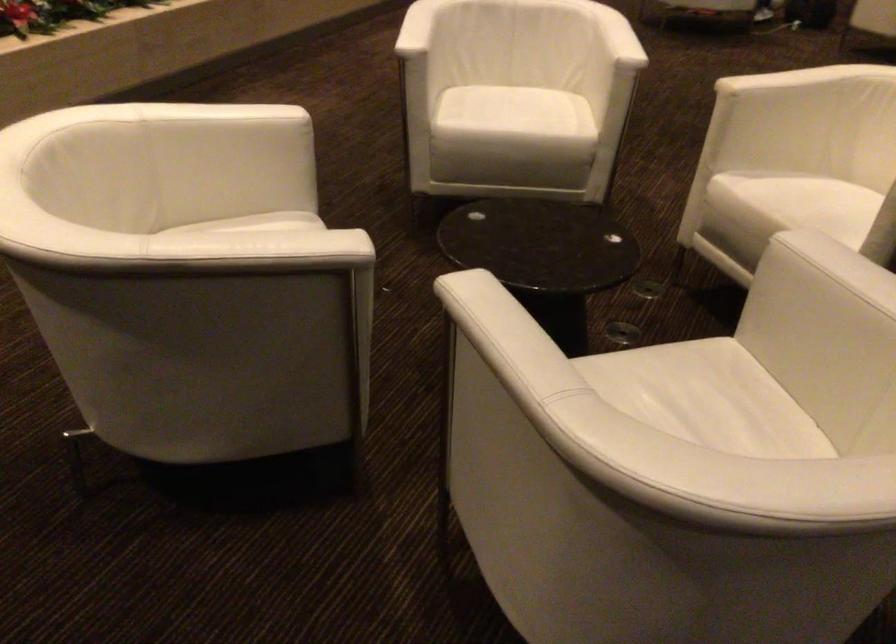
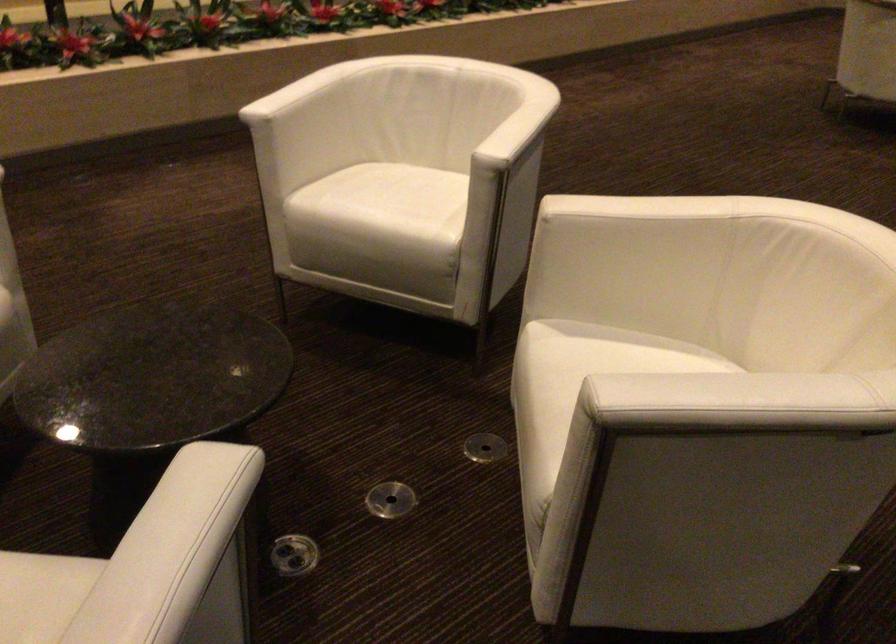
Where in the second image is the point corresponding to (788,191) from the first image?

(581, 366)